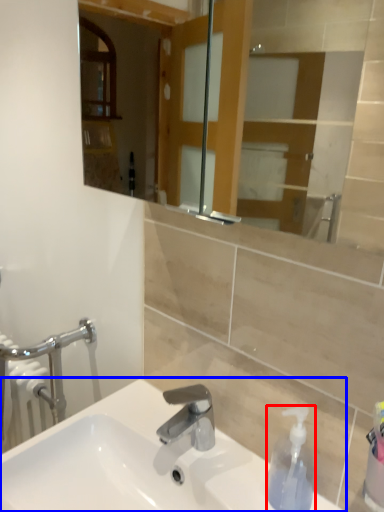
Question: Which object appears farthest to the camera in this image, soap dispenser (highlighted by a red box) or sink (highlighted by a blue box)?

Choices:
 (A) soap dispenser
 (B) sink

Answer: (A)